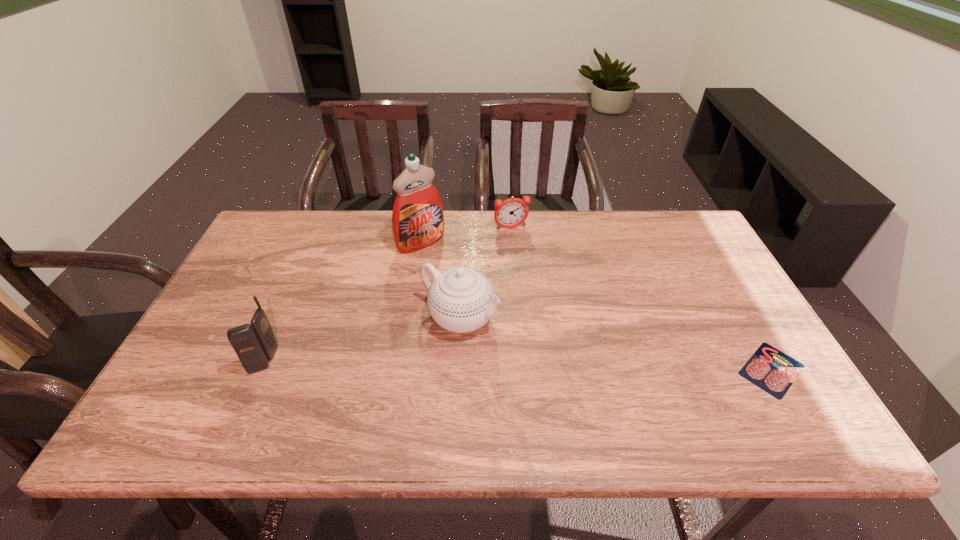
Image resolution: width=960 pixels, height=540 pixels. Find the location of `cellular telephone`. cellular telephone is located at coordinates (255, 344).

Image resolution: width=960 pixels, height=540 pixels. I want to click on the shortest object, so click(771, 370).

You are a GUI agent. You are given a task and a screenshot of the screen. Output one action in this format:
    pyautogui.click(x=<x>, y=<y>)
    Task: Click on the salami
    This screenshot has width=960, height=540.
    Given the screenshot: What is the action you would take?
    pyautogui.click(x=771, y=370)

The width and height of the screenshot is (960, 540). In order to click on chinaware in this screenshot , I will do `click(461, 300)`.

The width and height of the screenshot is (960, 540). Find the location of `the tallest object`. the tallest object is located at coordinates (417, 218).

This screenshot has width=960, height=540. I want to click on the fourth tallest object, so click(512, 212).

Where is `free space located on the keyboard of the leftmost object`? free space located on the keyboard of the leftmost object is located at coordinates (223, 361).

Where is `free space located 0.110m on the keyboard of the leftmost object`? free space located 0.110m on the keyboard of the leftmost object is located at coordinates (206, 361).

At what (x,y) coordinates should I click in order to perform the action: click on vacant space located 0.160m on the keyboard of the leftmost object. Please return your answer as a coordinate pair (x, y). Image resolution: width=960 pixels, height=540 pixels. Looking at the image, I should click on (185, 361).

Locate an element on the screen. This screenshot has width=960, height=540. vacant space located 0.340m on the back of the shortest object is located at coordinates (706, 255).